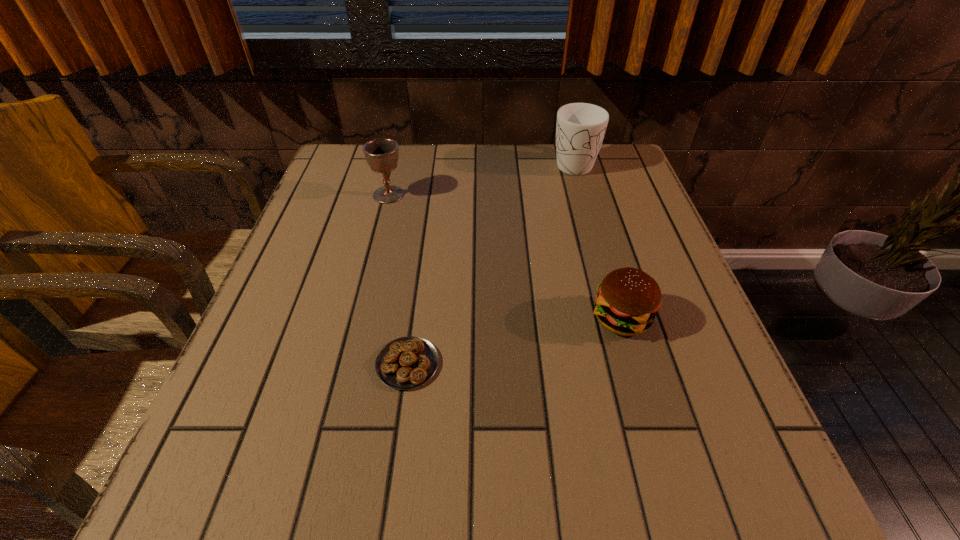
Image resolution: width=960 pixels, height=540 pixels. What are the coordinates of `the farthest object` in the screenshot? It's located at (580, 129).

Image resolution: width=960 pixels, height=540 pixels. I want to click on the second farthest object, so pyautogui.click(x=381, y=154).

Image resolution: width=960 pixels, height=540 pixels. Find the location of `the leftmost object`. the leftmost object is located at coordinates (381, 154).

Find the location of `the third tallest object`. the third tallest object is located at coordinates (628, 299).

The image size is (960, 540). Identify the location of the shortest object. (408, 362).

This screenshot has width=960, height=540. In order to click on pastry in this screenshot , I will do `click(408, 362)`.

Locate an element on the screen. This screenshot has height=540, width=960. blank area located on the side of the farthest object with the handle is located at coordinates (603, 265).

Locate an element on the screen. Image resolution: width=960 pixels, height=540 pixels. vacant space located 0.090m on the front of the chalice is located at coordinates (380, 227).

Identify the location of vacant space located 0.170m on the left of the second shortest object. (499, 318).

Identify the location of free space located 0.170m on the left of the shortest object. (277, 364).